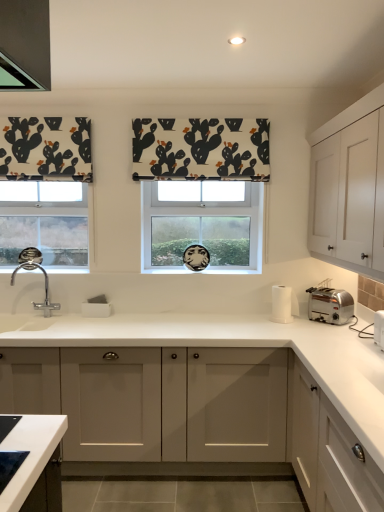
Identify the location of white matte cabinet at upper right, acting as the third cabinetry starting from the bottom. Image resolution: width=384 pixels, height=512 pixels. (347, 186).

This screenshot has height=512, width=384. What do you see at coordinates (347, 186) in the screenshot? I see `white matte cabinet at upper right, acting as the third cabinetry starting from the bottom` at bounding box center [347, 186].

Measure the distance between point (33, 302) and camera.

Point (33, 302) is 3.11 meters away from camera.

Describe the element at coordinates (202, 224) in the screenshot. The width and height of the screenshot is (384, 512). I see `clear glass window at center` at that location.

This screenshot has height=512, width=384. What do you see at coordinates (201, 149) in the screenshot? I see `white fabric with cactus print at center` at bounding box center [201, 149].

The image size is (384, 512). What do you see at coordinates (199, 414) in the screenshot?
I see `white matte cabinet at center, which is counted as the second cabinetry, starting from the top` at bounding box center [199, 414].

In order to face silver metallic toaster at right, the second appliance in the left-to-right sequence, should I rotate leftwards or rightwards?

A 25.777 degree turn to the right will do.

Identify the location of white matte cabinet at upper right, marked as the 1th cabinetry in a top-to-bottom arrangement. This screenshot has height=512, width=384. pyautogui.click(x=347, y=186).

Looking at their sizes, would you say white fabric with cactus print at center is wider or thinner than chrome metallic sink at left?

In the image, white fabric with cactus print at center appears to be more narrow than chrome metallic sink at left.

Is white fabric with cactus print at center oriented towards chrome metallic sink at left?

No, white fabric with cactus print at center is not oriented towards chrome metallic sink at left.

Does white fabric with cactus print at center appear on the right side of chrome metallic sink at left?

Yes, white fabric with cactus print at center is to the right of chrome metallic sink at left.

Is there a large distance between white fabric with cactus print at center and chrome metallic sink at left?

Yes, white fabric with cactus print at center is far from chrome metallic sink at left.

Would you consider silver metallic toaster at right, the first appliance viewed from the right, to be distant from white matte cabinet at upper right, acting as the third cabinetry starting from the bottom?

They are positioned close to each other.

Does silver metallic toaster at right, the second appliance in the left-to-right sequence, have a greater width compared to white matte cabinet at upper right, acting as the third cabinetry starting from the bottom?

No.

Is silver metallic toaster at right, the second appliance in the left-to-right sequence, in front of white matte cabinet at upper right, marked as the 1th cabinetry in a top-to-bottom arrangement?

No, silver metallic toaster at right, the second appliance in the left-to-right sequence, is further to the viewer.

From a real-world perspective, between silver metallic toaster at right, the second appliance when ordered from back to front, and white matte cabinet at upper right, marked as the 1th cabinetry in a top-to-bottom arrangement, who is vertically lower?

In real-world perspective, silver metallic toaster at right, the second appliance when ordered from back to front, is lower.

Does point (47, 315) come farther from viewer compared to point (319, 479)?

Yes.

Looking at their sizes, would you say chrome metallic sink at left is wider or thinner than white matte cabinet at lower right, arranged as the 3th cabinetry when viewed from the top?

In the image, chrome metallic sink at left appears to be more narrow than white matte cabinet at lower right, arranged as the 3th cabinetry when viewed from the top.

What are the coordinates of `the 2nd cabinetry positioned below the chrome metallic sink at left (from the image's perspective)` in the screenshot? It's located at (327, 450).

From a real-world perspective, relative to white matte cabinet at upper right, acting as the third cabinetry starting from the bottom, is clear glass window at center vertically above or below?

In terms of real-world spatial position, clear glass window at center is below white matte cabinet at upper right, acting as the third cabinetry starting from the bottom.

How different are the orientations of clear glass window at center and white matte cabinet at upper right, marked as the 1th cabinetry in a top-to-bottom arrangement, in degrees?

clear glass window at center and white matte cabinet at upper right, marked as the 1th cabinetry in a top-to-bottom arrangement, are facing 89.3 degrees away from each other.

Can you confirm if clear glass window at center is smaller than white matte cabinet at upper right, acting as the third cabinetry starting from the bottom?

Indeed, clear glass window at center has a smaller size compared to white matte cabinet at upper right, acting as the third cabinetry starting from the bottom.

Considering the sizes of clear glass window at center and white matte cabinet at upper right, marked as the 1th cabinetry in a top-to-bottom arrangement, in the image, is clear glass window at center wider or thinner than white matte cabinet at upper right, marked as the 1th cabinetry in a top-to-bottom arrangement,?

Considering their sizes, clear glass window at center looks slimmer than white matte cabinet at upper right, marked as the 1th cabinetry in a top-to-bottom arrangement.

In the scene shown: Are white matte cabinet at lower right, arranged as the 3th cabinetry when viewed from the top, and white fabric with cactus print at center located far from each other?

white matte cabinet at lower right, arranged as the 3th cabinetry when viewed from the top, is far away from white fabric with cactus print at center.

Is white matte cabinet at lower right, arranged as the 3th cabinetry when viewed from the top, oriented towards white fabric with cactus print at center?

No.

Between white matte cabinet at lower right, acting as the 1th cabinetry starting from the bottom, and white fabric with cactus print at center, which one has less height?

white fabric with cactus print at center.

Between point (303, 404) and point (243, 165), which one is positioned in front?

Positioned in front is point (303, 404).

You are a GUI agent. You are given a task and a screenshot of the screen. Output one action in this format:
    pyautogui.click(x=<x>, y=<y>)
    Task: Click on the appliance on the left of satin silver toaster at right
    
    Given the screenshot: What is the action you would take?
    pyautogui.click(x=283, y=304)

In the scene shown: Does satin silver toaster at right have a lesser width compared to white paper towel holder at right, positioned as the 1th appliance in back-to-front order?

Indeed, satin silver toaster at right has a lesser width compared to white paper towel holder at right, positioned as the 1th appliance in back-to-front order.

In the scene shown: Does satin silver toaster at right have a lesser height compared to white paper towel holder at right, the second appliance positioned from the front?

Yes, satin silver toaster at right is shorter than white paper towel holder at right, the second appliance positioned from the front.

From a real-world perspective, starting from the chrome metallic sink at left, which appliance is the 2nd one below it? Please provide its 2D coordinates.

[(379, 328)]

Would you consider silver metallic toaster at right, the first appliance viewed from the right, to be distant from chrome metallic sink at left?

Absolutely, silver metallic toaster at right, the first appliance viewed from the right, is distant from chrome metallic sink at left.

Considering the relative positions of silver metallic toaster at right, the first appliance viewed from the right, and chrome metallic sink at left in the image provided, is silver metallic toaster at right, the first appliance viewed from the right, to the left of chrome metallic sink at left from the viewer's perspective?

In fact, silver metallic toaster at right, the first appliance viewed from the right, is to the right of chrome metallic sink at left.

Consider the image. Considering the relative sizes of silver metallic toaster at right, the second appliance in the left-to-right sequence, and chrome metallic sink at left in the image provided, is silver metallic toaster at right, the second appliance in the left-to-right sequence, thinner than chrome metallic sink at left?

Indeed, silver metallic toaster at right, the second appliance in the left-to-right sequence, has a lesser width compared to chrome metallic sink at left.

At what (x,y) coordinates should I click in order to perform the action: click on curtain that appears on the right of chrome metallic sink at left. Please return your answer as a coordinate pair (x, y). The height and width of the screenshot is (512, 384). Looking at the image, I should click on (201, 149).

This screenshot has width=384, height=512. Identify the location of appliance that is the 1st object located behind the white matte cabinet at upper right, acting as the third cabinetry starting from the bottom. (379, 328).

Looking at the image, which one is located further to white matte cabinet at lower right, arranged as the 3th cabinetry when viewed from the top, white paper towel holder at right, arranged as the first appliance when viewed from the left, or white fabric with cactus print at center?

white fabric with cactus print at center is positioned further to the anchor white matte cabinet at lower right, arranged as the 3th cabinetry when viewed from the top.

Which object lies further to the anchor point satin silver toaster at right, silver metallic toaster at right, the second appliance when ordered from back to front, or white matte cabinet at lower right, arranged as the 3th cabinetry when viewed from the top?

Based on the image, white matte cabinet at lower right, arranged as the 3th cabinetry when viewed from the top, appears to be further to satin silver toaster at right.

Considering their positions, is white paper towel holder at right, the 2th appliance from the right, positioned further to white fabric with cactus print at center than white matte cabinet at upper right, marked as the 1th cabinetry in a top-to-bottom arrangement?

Based on the image, white paper towel holder at right, the 2th appliance from the right, appears to be further to white fabric with cactus print at center.

Based on their spatial positions, is white matte cabinet at lower right, acting as the 1th cabinetry starting from the bottom, or white fabric with cactus print at center closer to silver metallic toaster at right, the second appliance when ordered from back to front?

white matte cabinet at lower right, acting as the 1th cabinetry starting from the bottom, is closer to silver metallic toaster at right, the second appliance when ordered from back to front.

When comparing their distances from satin silver toaster at right, does chrome metallic sink at left or white matte cabinet at center, placed as the second cabinetry when sorted from bottom to top, seem further?

Among the two, chrome metallic sink at left is located further to satin silver toaster at right.

Based on their spatial positions, is satin silver toaster at right or chrome metallic sink at left further from white fabric with cactus print at center?

Based on the image, chrome metallic sink at left appears to be further to white fabric with cactus print at center.

Looking at the image, which one is located closer to clear glass window at center, chrome metallic sink at left or white paper towel holder at right, the 2th appliance from the right?

white paper towel holder at right, the 2th appliance from the right, is closer to clear glass window at center.

When comparing their distances from chrome metallic sink at left, does white matte cabinet at lower right, acting as the 1th cabinetry starting from the bottom, or white matte cabinet at center, which is counted as the second cabinetry, starting from the top, seem further?

Based on the image, white matte cabinet at lower right, acting as the 1th cabinetry starting from the bottom, appears to be further to chrome metallic sink at left.

At what (x,y) coordinates should I click in order to perform the action: click on cabinetry between white matte cabinet at lower right, acting as the 1th cabinetry starting from the bottom, and clear glass window at center from front to back. Please return your answer as a coordinate pair (x, y). Looking at the image, I should click on (347, 186).

The height and width of the screenshot is (512, 384). Identify the location of appliance located between white matte cabinet at upper right, acting as the third cabinetry starting from the bottom, and satin silver toaster at right in the depth direction. (379, 328).

Where is `toaster between white matte cabinet at center, placed as the second cabinetry when sorted from bottom to top, and chrome metallic sink at left, along the z-axis`? This screenshot has height=512, width=384. toaster between white matte cabinet at center, placed as the second cabinetry when sorted from bottom to top, and chrome metallic sink at left, along the z-axis is located at coordinates (330, 305).

Identify the location of toaster positioned between white matte cabinet at center, which is counted as the second cabinetry, starting from the top, and white fabric with cactus print at center from near to far. (330, 305).